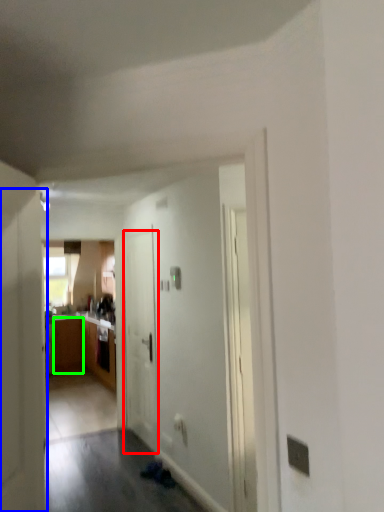
Question: Based on their relative distances, which object is nearer to door (highlighted by a red box)? Choose from door (highlighted by a blue box) and cabinetry (highlighted by a green box).

Choices:
 (A) door
 (B) cabinetry

Answer: (A)